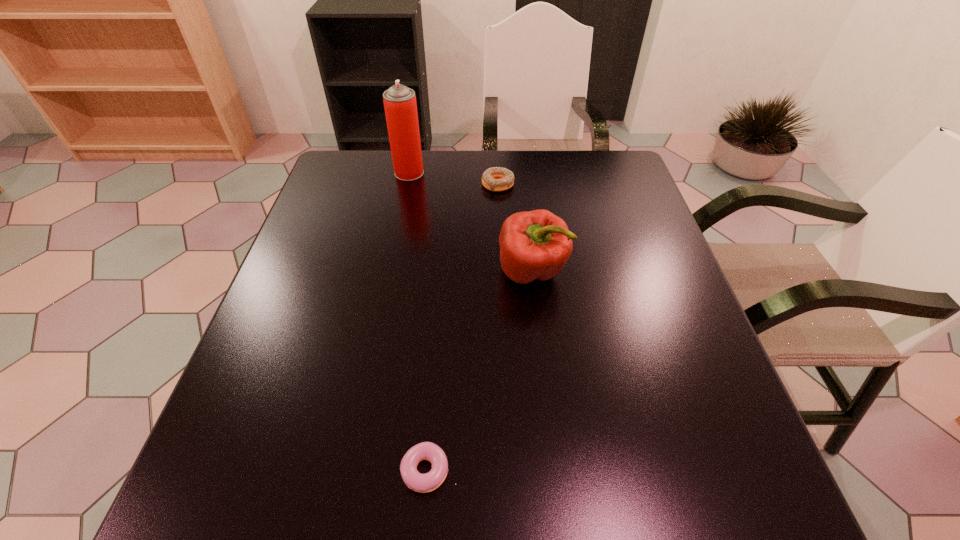
Locate an element on the screen. The width and height of the screenshot is (960, 540). free point located 0.330m on the right of the taller doughnut is located at coordinates (631, 184).

The height and width of the screenshot is (540, 960). I want to click on free space located 0.140m on the back of the shortest object, so click(437, 373).

This screenshot has width=960, height=540. Identify the location of aerosol can that is at the far edge. (400, 105).

At what (x,y) coordinates should I click in order to perform the action: click on doughnut located in the far edge section of the desktop. Please return your answer as a coordinate pair (x, y). Image resolution: width=960 pixels, height=540 pixels. Looking at the image, I should click on (496, 179).

At what (x,y) coordinates should I click in order to perform the action: click on object present at the near edge. Please return your answer as a coordinate pair (x, y). Looking at the image, I should click on (423, 483).

The width and height of the screenshot is (960, 540). What are the coordinates of `free space at the far edge of the desktop` in the screenshot? It's located at (459, 178).

In order to click on vacant space at the near edge in this screenshot , I will do `click(444, 500)`.

The height and width of the screenshot is (540, 960). In order to click on free spot at the left edge of the desktop in this screenshot , I will do `click(333, 294)`.

The height and width of the screenshot is (540, 960). In the image, there is a desktop. In order to click on vacant area at the right edge in this screenshot , I will do `click(653, 243)`.

What are the coordinates of `vacant space at the far left corner of the desktop` in the screenshot? It's located at (372, 180).